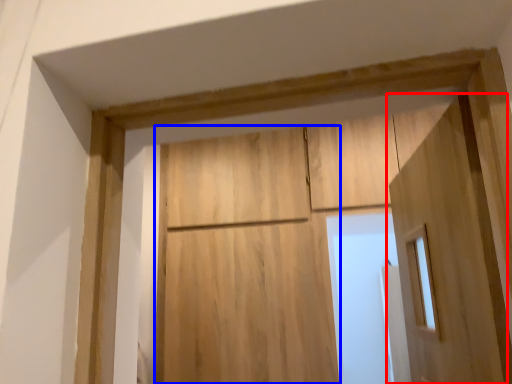
Question: Which object is closer to the camera taking this photo, door (highlighted by a red box) or barn door (highlighted by a blue box)?

Choices:
 (A) door
 (B) barn door

Answer: (A)